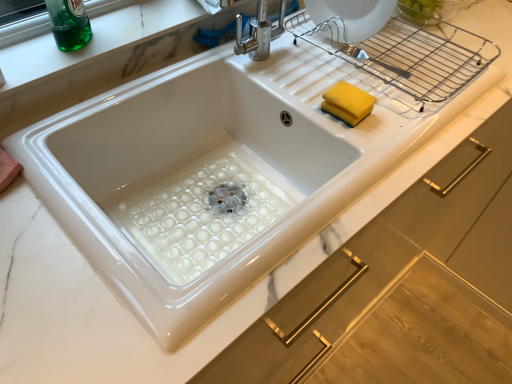
The height and width of the screenshot is (384, 512). Identify the location of vacant area that is in front of yellow sponge at upper right. (359, 165).